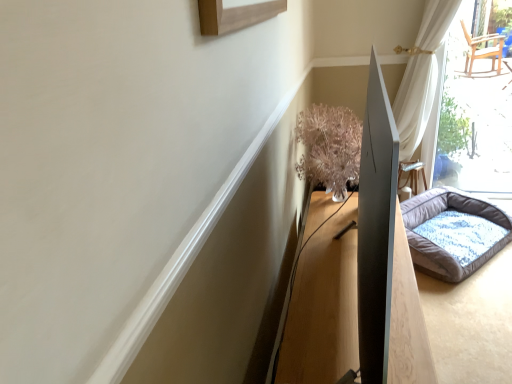
Describe the element at coordinates (446, 236) in the screenshot. The width and height of the screenshot is (512, 384). I see `fluffy gray dog bed at right` at that location.

Identify the location of translucent glass vase at upper right. The image size is (512, 384). (330, 148).

From a real-world perspective, is wooden table at center under fluffy gray dog bed at right?

Yes.

Would you say wooden table at center is outside fluffy gray dog bed at right?

Yes.

Which is more to the left, wooden table at center or fluffy gray dog bed at right?

wooden table at center is more to the left.

Is translucent glass vase at upper right surrounded by fluffy gray dog bed at right?

No, translucent glass vase at upper right is not inside fluffy gray dog bed at right.

Which object is further away from the camera taking this photo, fluffy gray dog bed at right or translucent glass vase at upper right?

fluffy gray dog bed at right is further away from the camera.

How distant is fluffy gray dog bed at right from translucent glass vase at upper right?

A distance of 32.70 inches exists between fluffy gray dog bed at right and translucent glass vase at upper right.

Consider the image. Is fluffy gray dog bed at right taller or shorter than translucent glass vase at upper right?

Considering their sizes, fluffy gray dog bed at right has less height than translucent glass vase at upper right.

Is translucent glass vase at upper right oriented away from fluffy gray dog bed at right?

translucent glass vase at upper right is not turned away from fluffy gray dog bed at right.

The width and height of the screenshot is (512, 384). I want to click on dog bed directly beneath the translucent glass vase at upper right (from a real-world perspective), so click(x=446, y=236).

Which object is wider, translucent glass vase at upper right or fluffy gray dog bed at right?

fluffy gray dog bed at right.

Between translucent glass vase at upper right and fluffy gray dog bed at right, which one has smaller size?

Smaller between the two is translucent glass vase at upper right.

Is translucent glass vase at upper right located within wooden table at center?

No.

Identify the location of plant on the left of the wooden table at center. (330, 148).

Is wooden table at center bigger or smaller than translucent glass vase at upper right?

Considering their sizes, wooden table at center takes up more space than translucent glass vase at upper right.

Considering the sizes of objects wooden table at center and translucent glass vase at upper right in the image provided, who is wider, wooden table at center or translucent glass vase at upper right?

wooden table at center is wider.

Based on the photo, is fluffy gray dog bed at right thinner than wooden table at center?

Yes, fluffy gray dog bed at right is thinner than wooden table at center.

Which is more to the right, fluffy gray dog bed at right or wooden table at center?

From the viewer's perspective, fluffy gray dog bed at right appears more on the right side.

In the scene shown: Is fluffy gray dog bed at right oriented away from wooden table at center?

No.

Is fluffy gray dog bed at right far away from wooden table at center?

No, fluffy gray dog bed at right is not far from wooden table at center.

Identify the location of plant located behind the wooden table at center. (330, 148).

Is translucent glass vase at upper right positioned with its back to wooden table at center?

No, wooden table at center is not at the back of translucent glass vase at upper right.

Consider the image. Which object is further away from the camera taking this photo, translucent glass vase at upper right or wooden table at center?

Positioned behind is translucent glass vase at upper right.

From their relative heights in the image, would you say translucent glass vase at upper right is taller or shorter than wooden table at center?

In the image, translucent glass vase at upper right appears to be taller than wooden table at center.

Identify the location of table below the fluffy gray dog bed at right (from the image's perspective). tap(323, 307).

Locate an element on the screen. The height and width of the screenshot is (384, 512). dog bed below the translucent glass vase at upper right (from a real-world perspective) is located at coordinates (446, 236).

Based on the photo, estimate the real-world distances between objects in this image. Which object is closer to wooden table at center, translucent glass vase at upper right or fluffy gray dog bed at right?

translucent glass vase at upper right.

Which object lies nearer to the anchor point translucent glass vase at upper right, wooden table at center or fluffy gray dog bed at right?

Based on the image, wooden table at center appears to be nearer to translucent glass vase at upper right.

From the image, which object appears to be farther from fluffy gray dog bed at right, wooden table at center or translucent glass vase at upper right?

Among the two, wooden table at center is located further to fluffy gray dog bed at right.

When comparing their distances from wooden table at center, does fluffy gray dog bed at right or translucent glass vase at upper right seem further?

fluffy gray dog bed at right is positioned further to the anchor wooden table at center.

Estimate the real-world distances between objects in this image. Which object is further from translucent glass vase at upper right, fluffy gray dog bed at right or wooden table at center?

fluffy gray dog bed at right is positioned further to the anchor translucent glass vase at upper right.

Looking at the image, which one is located further to fluffy gray dog bed at right, translucent glass vase at upper right or wooden table at center?

wooden table at center is positioned further to the anchor fluffy gray dog bed at right.

Locate an element on the screen. This screenshot has height=384, width=512. table between translucent glass vase at upper right and fluffy gray dog bed at right from left to right is located at coordinates (323, 307).